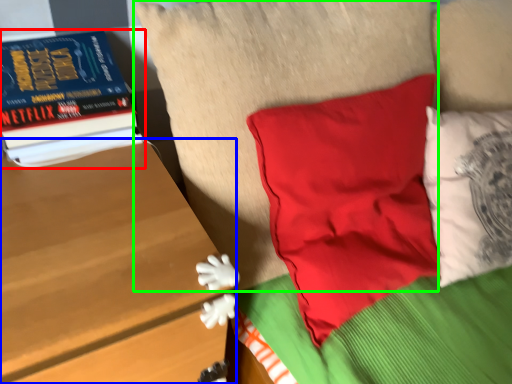
Question: Which object is the farthest from book (highlighted by a red box)? Choose among these: table (highlighted by a blue box) or pillow (highlighted by a green box).

Choices:
 (A) table
 (B) pillow

Answer: (B)